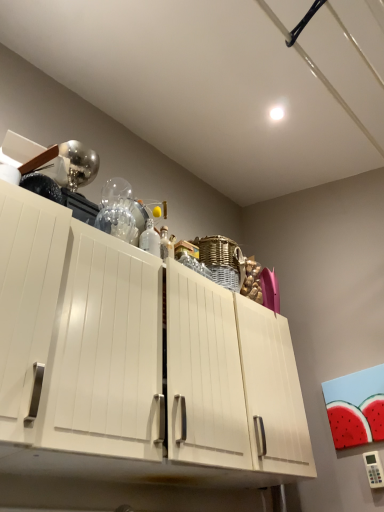
Identify the location of white glossy cabinet at center. (136, 362).

In order to face white glossy cabinet at center, should I rotate leftwards or rightwards?

A 5.360 degree turn to the left will do.

The width and height of the screenshot is (384, 512). What do you see at coordinates (136, 362) in the screenshot?
I see `white glossy cabinet at center` at bounding box center [136, 362].

In order to face white glossy bottle at upper center, should I rotate leftwards or rightwards?

Turn left approximately 5.433 degrees to face it.

Image resolution: width=384 pixels, height=512 pixels. What do you see at coordinates (150, 239) in the screenshot?
I see `white glossy bottle at upper center` at bounding box center [150, 239].

Identify the location of white glossy bottle at upper center. The height and width of the screenshot is (512, 384). (150, 239).

At what (x,y) coordinates should I click in order to perform the action: click on white glossy cabinet at center. Please return your answer as a coordinate pair (x, y). Looking at the image, I should click on (136, 362).

Which object is positioned more to the right, white glossy bottle at upper center or white glossy cabinet at center?

white glossy cabinet at center.

Who is more distant, white glossy bottle at upper center or white glossy cabinet at center?

white glossy bottle at upper center.

Is point (159, 252) in front of point (180, 469)?

No, it is behind (180, 469).

From the image's perspective, is white glossy bottle at upper center positioned above or below white glossy cabinet at center?

Based on their image positions, white glossy bottle at upper center is located above white glossy cabinet at center.

From a real-world perspective, between white glossy bottle at upper center and white glossy cabinet at center, who is vertically lower?

white glossy cabinet at center is physically lower.

Does white glossy bottle at upper center have a lesser width compared to white glossy cabinet at center?

Yes, white glossy bottle at upper center is thinner than white glossy cabinet at center.

Considering the sizes of objects white glossy bottle at upper center and white glossy cabinet at center in the image provided, who is taller, white glossy bottle at upper center or white glossy cabinet at center?

white glossy cabinet at center is taller.

Considering the sizes of objects white glossy bottle at upper center and white glossy cabinet at center in the image provided, who is bigger, white glossy bottle at upper center or white glossy cabinet at center?

Bigger between the two is white glossy cabinet at center.

Can we say white glossy bottle at upper center lies outside white glossy cabinet at center?

white glossy bottle at upper center lies outside white glossy cabinet at center's area.

Is white glossy bottle at upper center not near white glossy cabinet at center?

No, white glossy bottle at upper center is not far away from white glossy cabinet at center.

Is white glossy bottle at upper center oriented towards white glossy cabinet at center?

No.

What's the angular difference between white glossy bottle at upper center and white glossy cabinet at center's facing directions?

white glossy bottle at upper center and white glossy cabinet at center are facing 1.85 degrees away from each other.

Based on the photo, measure the distance from white glossy bottle at upper center to white glossy cabinet at center.

A distance of 53.95 centimeters exists between white glossy bottle at upper center and white glossy cabinet at center.

Where is `bottle behind the white glossy cabinet at center`? bottle behind the white glossy cabinet at center is located at coordinates (150, 239).

Is white glossy cabinet at center at the right side of white glossy bottle at upper center?

Yes.

Considering their positions, is white glossy cabinet at center located in front of or behind white glossy bottle at upper center?

Clearly, white glossy cabinet at center is in front of white glossy bottle at upper center.

Which is closer, (96, 333) or (145, 238)?

Positioned in front is point (96, 333).

From the image's perspective, who appears lower, white glossy cabinet at center or white glossy bottle at upper center?

From the image's view, white glossy cabinet at center is below.

From a real-world perspective, is white glossy cabinet at center positioned over white glossy bottle at upper center based on gravity?

No, from a real-world perspective, white glossy cabinet at center is not above white glossy bottle at upper center.

Based on the photo, can you confirm if white glossy cabinet at center is wider than white glossy bottle at upper center?

Indeed, white glossy cabinet at center has a greater width compared to white glossy bottle at upper center.

Does white glossy cabinet at center have a lesser height compared to white glossy bottle at upper center?

Incorrect, the height of white glossy cabinet at center does not fall short of that of white glossy bottle at upper center.

Which of these two, white glossy cabinet at center or white glossy bottle at upper center, is bigger?

Bigger between the two is white glossy cabinet at center.

Is white glossy cabinet at center inside the boundaries of white glossy bottle at upper center, or outside?

white glossy cabinet at center is not enclosed by white glossy bottle at upper center.

Is white glossy cabinet at center in contact with white glossy bottle at upper center?

white glossy cabinet at center and white glossy bottle at upper center are not in contact.

Could you tell me if white glossy cabinet at center is facing white glossy bottle at upper center?

No, white glossy cabinet at center is not facing towards white glossy bottle at upper center.

How different are the orientations of white glossy cabinet at center and white glossy bottle at upper center in degrees?

There is a 1.85-degree angle between the facing directions of white glossy cabinet at center and white glossy bottle at upper center.

How much distance is there between white glossy cabinet at center and white glossy bottle at upper center?

white glossy cabinet at center and white glossy bottle at upper center are 21.24 inches apart.

Identify the location of cabinetry lying below the white glossy bottle at upper center (from the image's perspective). The width and height of the screenshot is (384, 512). (136, 362).

In order to click on bottle above the white glossy cabinet at center (from a real-world perspective) in this screenshot , I will do `click(150, 239)`.

In order to click on cabinetry in front of the white glossy bottle at upper center in this screenshot , I will do (136, 362).